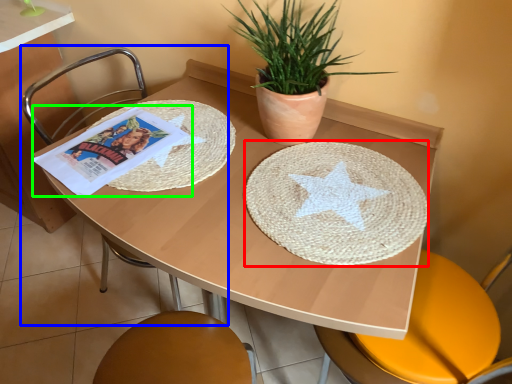
Question: Based on their relative distances, which object is farther from paper plate (highlighted by a red box)? Choose from chair (highlighted by a blue box) and comic book (highlighted by a green box).

Choices:
 (A) chair
 (B) comic book

Answer: (A)